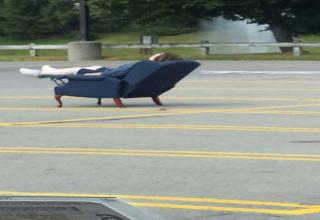
Locate an element on the screen. This screenshot has height=220, width=320. floor is located at coordinates (150, 135).